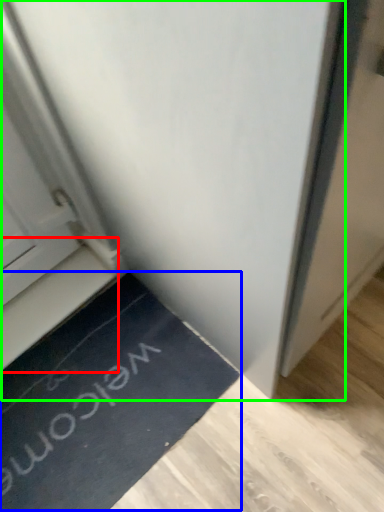
Question: Which is nearer to the stairwell (highlighted by a red box)? doormat (highlighted by a blue box) or door (highlighted by a green box).

Choices:
 (A) doormat
 (B) door

Answer: (A)